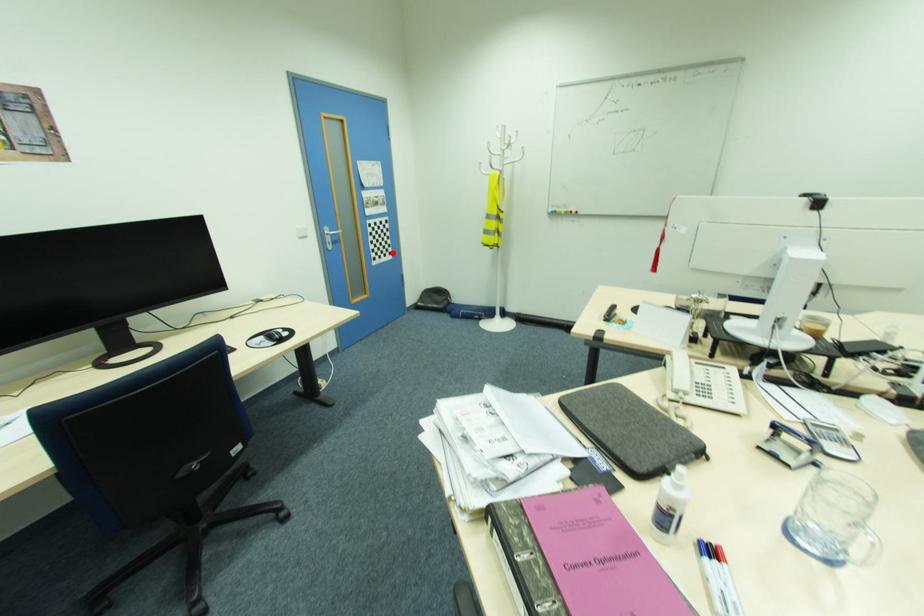
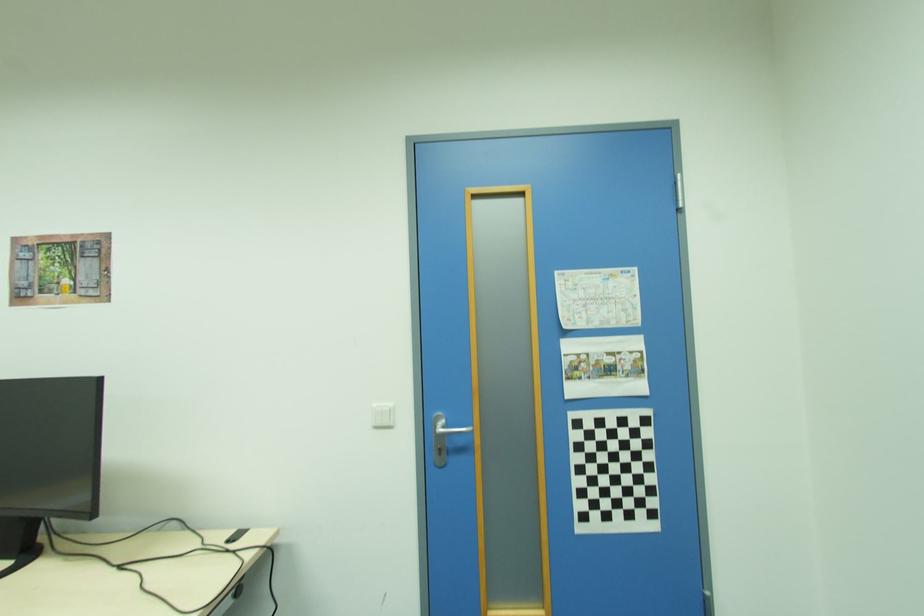
The point at the highlighted location is marked in the first image. Where is the corresponding point in the second image?

(655, 515)